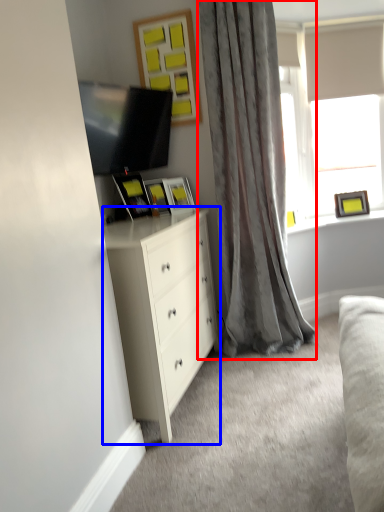
Question: Among these objects, which one is farthest to the camera, curtain (highlighted by a red box) or chest of drawers (highlighted by a blue box)?

Choices:
 (A) curtain
 (B) chest of drawers

Answer: (A)